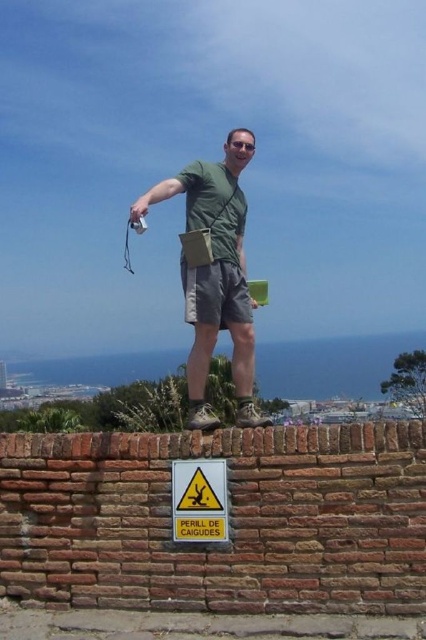
Question: Which object appears farthest from the camera in this image?

Choices:
 (A) sunglasses at center
 (B) green matte t-shirt at center
 (C) yellowmaterial/texturewarning sign at lower center

Answer: (A)

Question: Does green matte t-shirt at center appear under sunglasses at center?

Choices:
 (A) no
 (B) yes

Answer: (B)

Question: Which object is closer to the camera taking this photo?

Choices:
 (A) yellowmaterial/texturewarning sign at lower center
 (B) sunglasses at center

Answer: (A)

Question: Can you confirm if yellowmaterial/texturewarning sign at lower center is positioned to the right of sunglasses at center?

Choices:
 (A) no
 (B) yes

Answer: (A)

Question: Can you confirm if green matte t-shirt at center is positioned above sunglasses at center?

Choices:
 (A) yes
 (B) no

Answer: (B)

Question: Which is farther from the sunglasses at center?

Choices:
 (A) yellowmaterial/texturewarning sign at lower center
 (B) green matte t-shirt at center

Answer: (A)